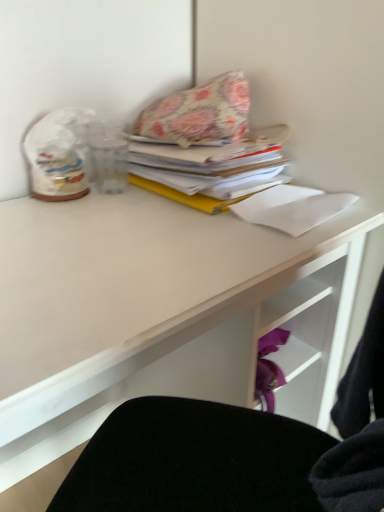
Question: Considering the relative sizes of white paper at upper right and white matte desk at upper center in the image provided, is white paper at upper right smaller than white matte desk at upper center?

Choices:
 (A) no
 (B) yes

Answer: (B)

Question: Considering the relative positions of white paper at upper right and white matte desk at upper center in the image provided, is white paper at upper right in front of white matte desk at upper center?

Choices:
 (A) no
 (B) yes

Answer: (A)

Question: Is white paper at upper right next to white matte desk at upper center?

Choices:
 (A) yes
 (B) no

Answer: (B)

Question: From a real-world perspective, is white paper at upper right below white matte desk at upper center?

Choices:
 (A) no
 (B) yes

Answer: (A)

Question: Is white paper at upper right turned away from white matte desk at upper center?

Choices:
 (A) no
 (B) yes

Answer: (B)

Question: Is white paper at upper right taller or shorter than floral fabric pillow at upper center?

Choices:
 (A) short
 (B) tall

Answer: (A)

Question: From the image's perspective, is white paper at upper right above or below floral fabric pillow at upper center?

Choices:
 (A) above
 (B) below

Answer: (B)

Question: In the image, is white paper at upper right positioned in front of or behind floral fabric pillow at upper center?

Choices:
 (A) behind
 (B) front

Answer: (B)

Question: From a real-world perspective, is white paper at upper right physically located above or below floral fabric pillow at upper center?

Choices:
 (A) below
 (B) above

Answer: (A)

Question: Looking at the image, does white matte desk at upper center seem bigger or smaller compared to white paper at upper right?

Choices:
 (A) big
 (B) small

Answer: (A)

Question: Is white matte desk at upper center situated inside white paper at upper right or outside?

Choices:
 (A) outside
 (B) inside

Answer: (A)

Question: From the image's perspective, is white matte desk at upper center located above or below white paper at upper right?

Choices:
 (A) above
 (B) below

Answer: (B)

Question: Is point coord(337,294) closer or farther from the camera than point coord(317,221)?

Choices:
 (A) farther
 (B) closer

Answer: (A)

Question: From the image's perspective, relative to floral fabric pillow at upper center, is white matte desk at upper center above or below?

Choices:
 (A) below
 (B) above

Answer: (A)

Question: Considering the positions of white matte desk at upper center and floral fabric pillow at upper center in the image, is white matte desk at upper center wider or thinner than floral fabric pillow at upper center?

Choices:
 (A) thin
 (B) wide

Answer: (B)